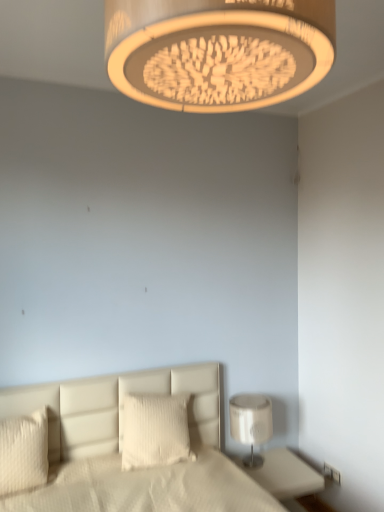
Question: From a real-world perspective, relative to white glossy lamp at lower right, arranged as the 2th lamp when viewed from the front, is white leather bed at lower center vertically above or below?

Choices:
 (A) below
 (B) above

Answer: (B)

Question: Relative to white glossy lamp at lower right, the 1th lamp ordered from the bottom, is white leather bed at lower center in front or behind?

Choices:
 (A) front
 (B) behind

Answer: (A)

Question: Estimate the real-world distances between objects in this image. Which object is farther from the white textured pillow at lower left, the first pillow viewed from the front?

Choices:
 (A) white leather bed at lower center
 (B) matte beige lampshade at upper center, the 1th lamp positioned from the front
 (C) white textured pillow at center, marked as the second pillow in a left-to-right arrangement
 (D) white glossy nightstand at lower right
 (E) white plastic electric outlet at lower right

Answer: (B)

Question: Which object is the farthest from the white textured pillow at lower left, arranged as the 1th pillow when viewed from the left?

Choices:
 (A) matte beige lampshade at upper center, placed as the 1th lamp when sorted from top to bottom
 (B) white glossy lamp at lower right, the 1th lamp ordered from the bottom
 (C) white textured pillow at center, the 2th pillow positioned from the front
 (D) white leather bed at lower center
 (E) white glossy nightstand at lower right

Answer: (A)